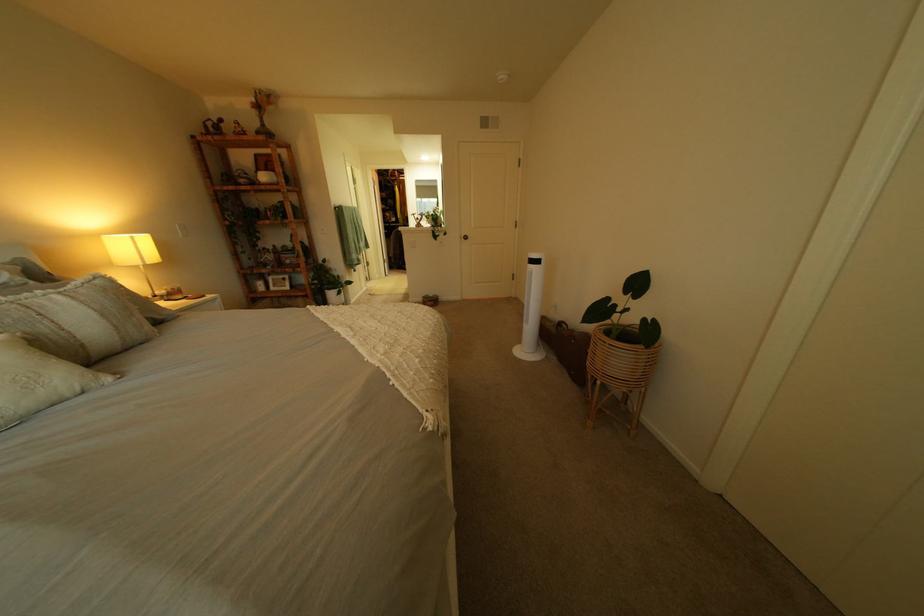
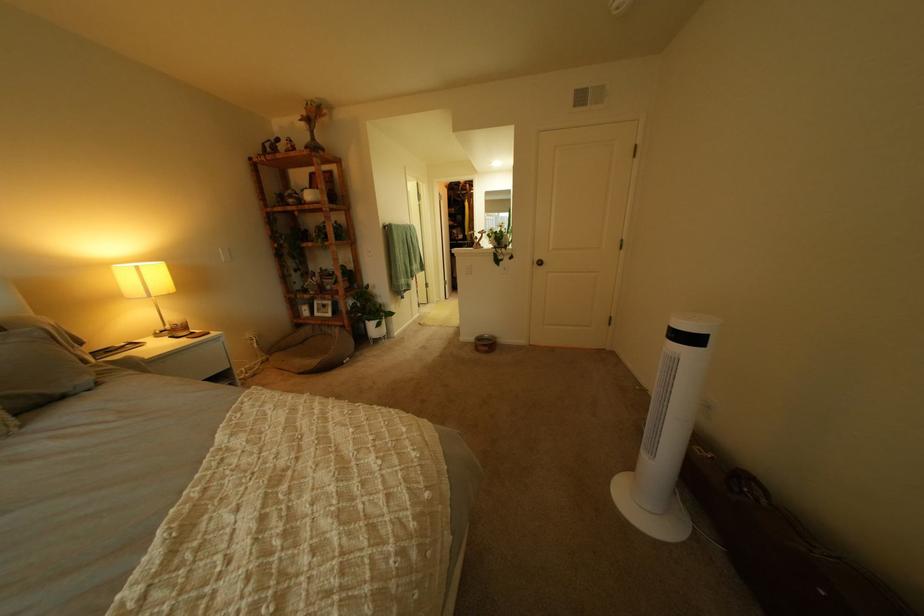
Locate, in the second image, the point that corresponds to point 553,262 in the first image.

(710, 341)